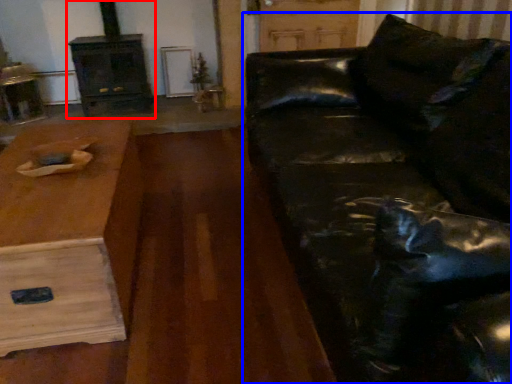
Question: Which object appears closest to the camera in this image, fireplace (highlighted by a red box) or studio couch (highlighted by a blue box)?

Choices:
 (A) fireplace
 (B) studio couch

Answer: (B)